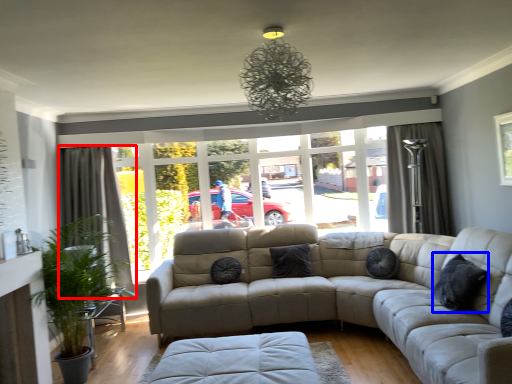
Question: Which of the following is the closest to the observer, curtain (highlighted by a red box) or pillow (highlighted by a blue box)?

Choices:
 (A) curtain
 (B) pillow

Answer: (B)